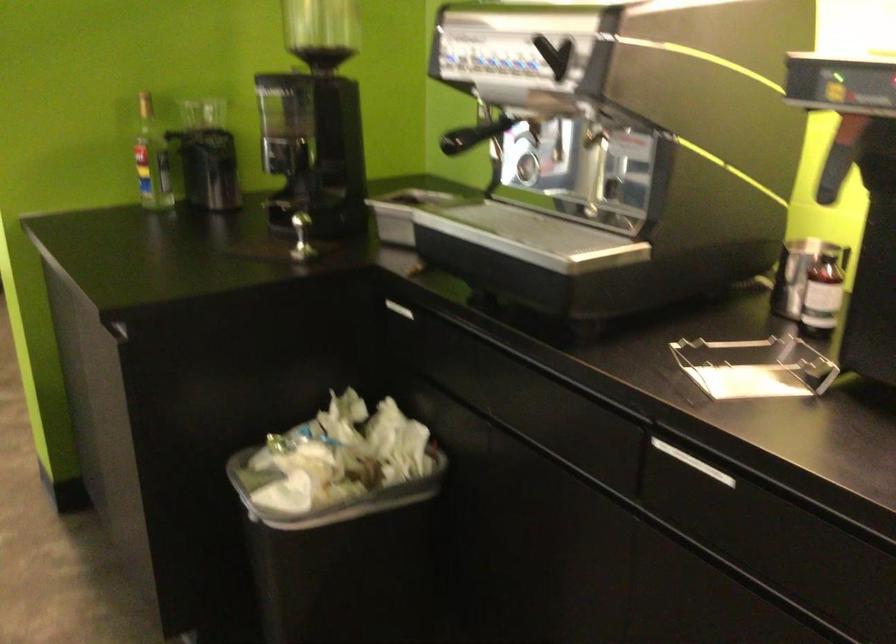
The width and height of the screenshot is (896, 644). What do you see at coordinates (484, 131) in the screenshot? I see `the dispenser handle` at bounding box center [484, 131].